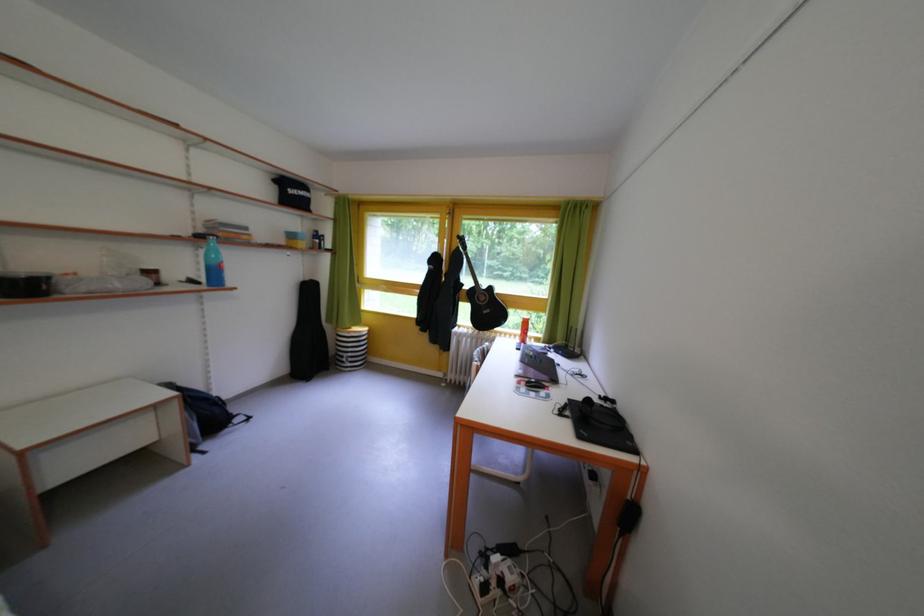
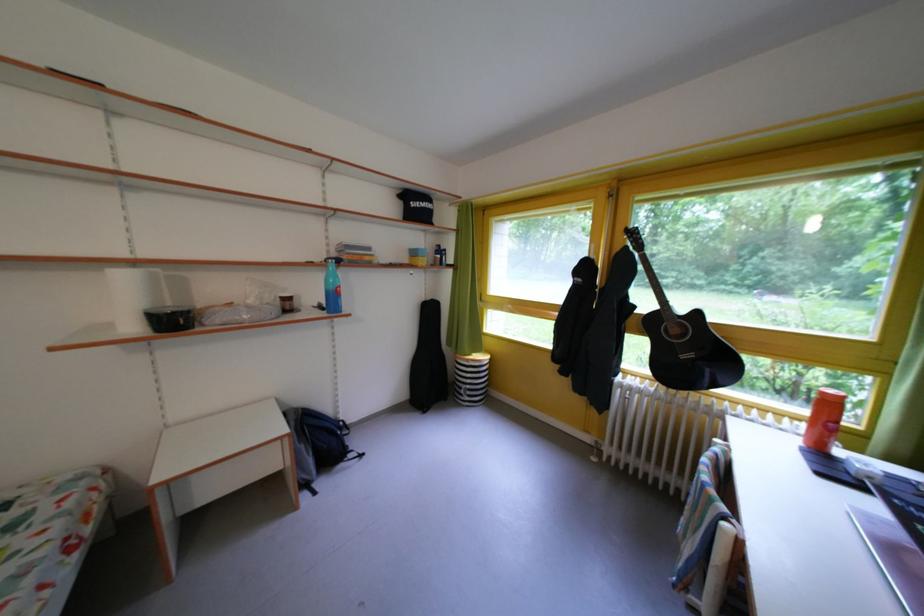
Locate, in the second image, the point that corresponds to (x=359, y=360) in the first image.

(478, 392)